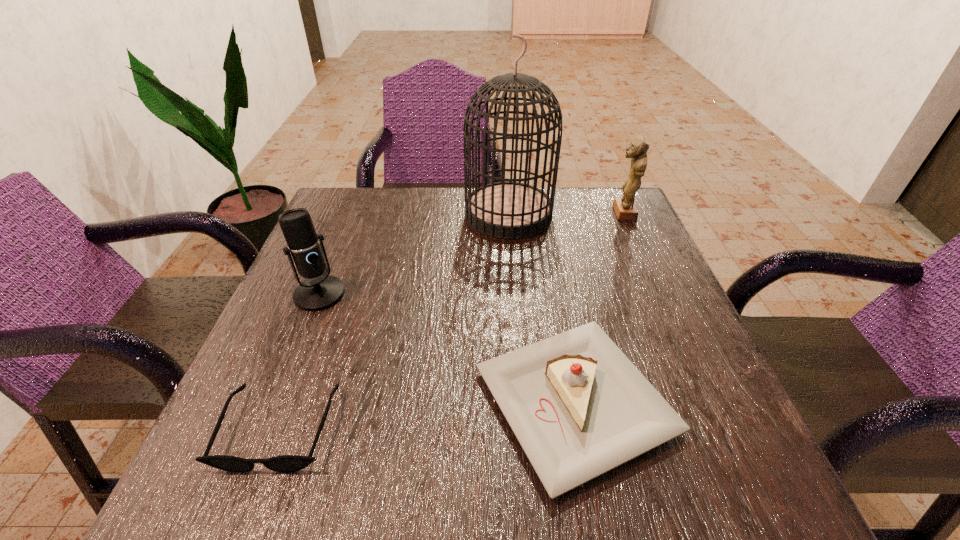
This screenshot has width=960, height=540. Identify the location of blank region between the shortest object and the third nearest object. (300, 361).

Locate an element on the screen. The height and width of the screenshot is (540, 960). vacant point located between the birdcage and the second shortest object is located at coordinates pyautogui.click(x=541, y=308).

Locate an element on the screen. This screenshot has width=960, height=540. free space between the third nearest object and the cake is located at coordinates (447, 348).

This screenshot has width=960, height=540. I want to click on vacant space that's between the tallest object and the sunglasses, so click(395, 321).

Locate an element on the screen. The width and height of the screenshot is (960, 540). free spot between the microphone and the rightmost object is located at coordinates (471, 253).

Where is `vacant area that lies between the rightmost object and the fourth tallest object`? vacant area that lies between the rightmost object and the fourth tallest object is located at coordinates [599, 307].

Where is `vacant area that lies between the birdcage and the rightmost object`? This screenshot has height=540, width=960. vacant area that lies between the birdcage and the rightmost object is located at coordinates (565, 214).

Find the location of a particular element. This screenshot has height=540, width=960. vacant space that is in between the figurine and the fourth tallest object is located at coordinates (599, 307).

The height and width of the screenshot is (540, 960). Identify the location of the second closest object to the figurine. (579, 408).

Where is `the third closest object relative to the microphone`? The width and height of the screenshot is (960, 540). the third closest object relative to the microphone is located at coordinates click(507, 210).